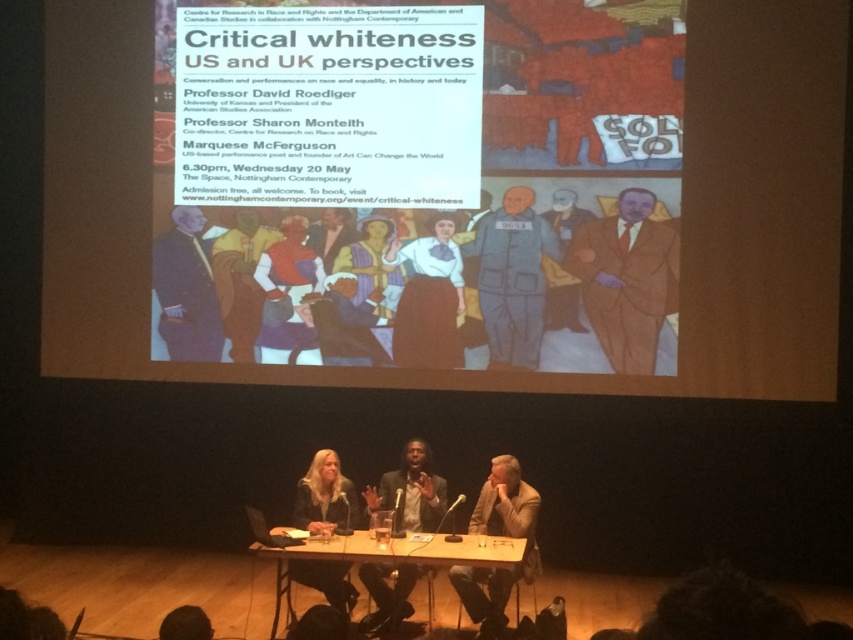
Can you confirm if matte paper poster at center is positioned to the left of matte gray jumpsuit at center?

No, matte paper poster at center is not to the left of matte gray jumpsuit at center.

Between matte paper poster at center and matte gray jumpsuit at center, which one has less height?

Standing shorter between the two is matte gray jumpsuit at center.

Which is in front, point (112, 300) or point (498, 276)?

Positioned in front is point (498, 276).

This screenshot has height=640, width=853. I want to click on matte paper poster at center, so click(x=453, y=186).

Does brown textured suit at right appear on the left side of wooden at center?

No, brown textured suit at right is not to the left of wooden at center.

What do you see at coordinates (625, 278) in the screenshot? This screenshot has width=853, height=640. I see `brown textured suit at right` at bounding box center [625, 278].

Is point (637, 292) less distant than point (393, 544)?

No.

At what (x,y) coordinates should I click in order to perform the action: click on brown textured suit at right. Please return your answer as a coordinate pair (x, y). The height and width of the screenshot is (640, 853). Looking at the image, I should click on (625, 278).

Consider the image. Does brown textured suit at right appear under matte brown suit at center?

Correct, brown textured suit at right is located below matte brown suit at center.

Between brown textured suit at right and matte brown suit at center, which one has more height?

With more height is brown textured suit at right.

The width and height of the screenshot is (853, 640). I want to click on brown textured suit at right, so click(625, 278).

In order to click on brown textured suit at right in this screenshot , I will do `click(625, 278)`.